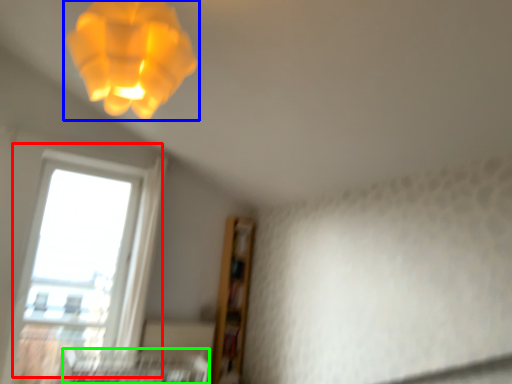
Question: Which object is positioned closest to window (highlighted by a red box)? Select from lamp (highlighted by a blue box) and bed frame (highlighted by a green box).

Choices:
 (A) lamp
 (B) bed frame

Answer: (B)